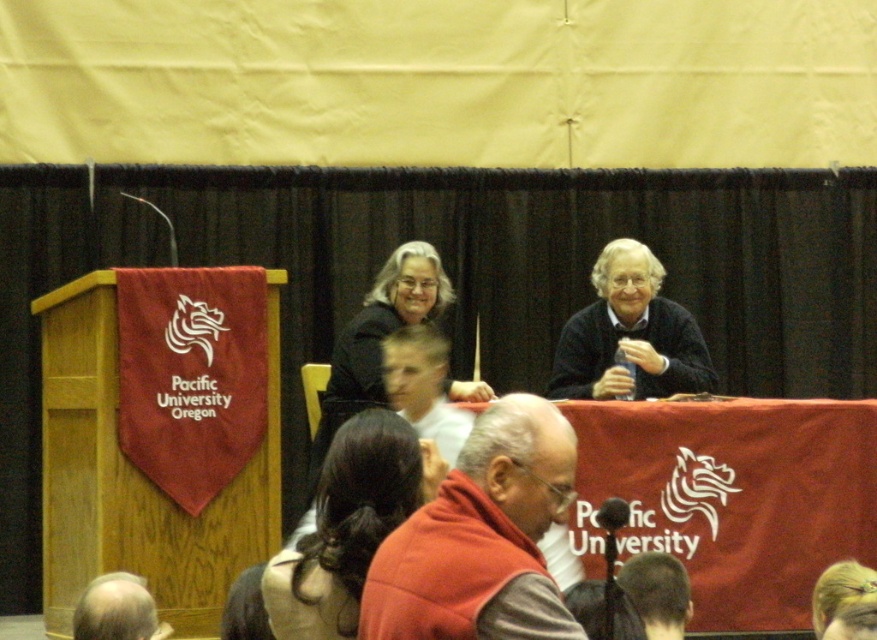
Measure the distance between red sweater vest at center and gray hair at lower left.

The distance of red sweater vest at center from gray hair at lower left is 4.44 feet.

Does red sweater vest at center have a lesser height compared to gray hair at lower left?

Incorrect, red sweater vest at center's height does not fall short of gray hair at lower left's.

Between point (412, 538) and point (132, 593), which one is positioned behind?

The point (132, 593) is behind.

Find the location of a particular element. red sweater vest at center is located at coordinates (481, 538).

Is red sweater vest at center bigger than dark brown hair at center?

Yes.

Between point (398, 612) and point (346, 513), which one is positioned behind?

The point (346, 513) is behind.

Image resolution: width=877 pixels, height=640 pixels. I want to click on red sweater vest at center, so click(481, 538).

Who is higher up, dark brown hair at center or gray hair at lower left?

dark brown hair at center

Does dark brown hair at center have a lesser width compared to gray hair at lower left?

→ Incorrect, dark brown hair at center's width is not less than gray hair at lower left's.

Where is `dark brown hair at center`? The width and height of the screenshot is (877, 640). dark brown hair at center is located at coordinates pos(348,524).